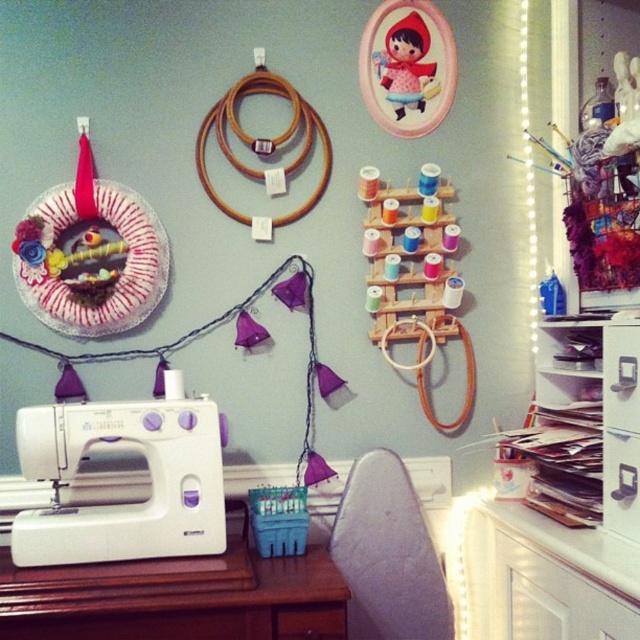
Is white wood table at lower left further to the viewer compared to matte pink fabric doll at upper center?

No, white wood table at lower left is closer to the viewer.

Where is `white wood table at lower left`? white wood table at lower left is located at coordinates (177, 598).

Is point (292, 573) behind point (381, 65)?

No, (292, 573) is closer to viewer.

Locate an element on the screen. This screenshot has width=640, height=640. white wood table at lower left is located at coordinates (177, 598).

In the scene shown: Who is taller, white glossy dresser at right or white plastic sewing machine at lower left?

With more height is white glossy dresser at right.

Is white glossy dresser at right below white plastic sewing machine at lower left?

Indeed, white glossy dresser at right is positioned under white plastic sewing machine at lower left.

Is point (502, 435) less distant than point (172, 374)?

No, (502, 435) is behind (172, 374).

Identify the location of white glossy dresser at right. This screenshot has height=640, width=640. (561, 499).

Who is lower down, white glossy dresser at right or matte wood drawer at lower center?

matte wood drawer at lower center is below.

What do you see at coordinates (561, 499) in the screenshot?
I see `white glossy dresser at right` at bounding box center [561, 499].

Describe the element at coordinates (561, 499) in the screenshot. This screenshot has width=640, height=640. I see `white glossy dresser at right` at that location.

Identify the location of white glossy dresser at right. (561, 499).